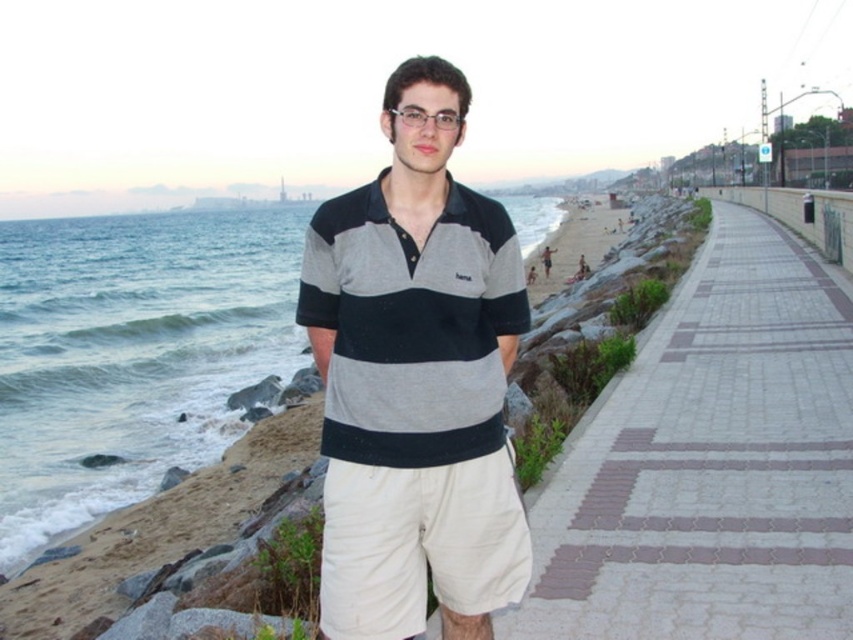
Which is behind, point (399, 141) or point (486, 472)?

The point (399, 141) is behind.

Identify the location of striped cotton polo shirt at center. The width and height of the screenshot is (853, 640). (415, 380).

The height and width of the screenshot is (640, 853). Find the location of `striped cotton polo shirt at center`. striped cotton polo shirt at center is located at coordinates (415, 380).

Who is more distant from viewer, [643,529] or [451,81]?

The point [643,529] is more distant.

Is paved stone walkway at right positioned at the back of striped cotton polo shirt at center?

Yes, it is behind striped cotton polo shirt at center.

Which is in front, point (647, 438) or point (352, 410)?

Point (352, 410) is more forward.

I want to click on paved stone walkway at right, so click(x=712, y=464).

Does point (612, 502) lie behind point (367, 566)?

Yes.

Which is behind, point (769, 225) or point (401, 552)?

The point (769, 225) is more distant.

Find the location of a particular element. paved stone walkway at right is located at coordinates (712, 464).